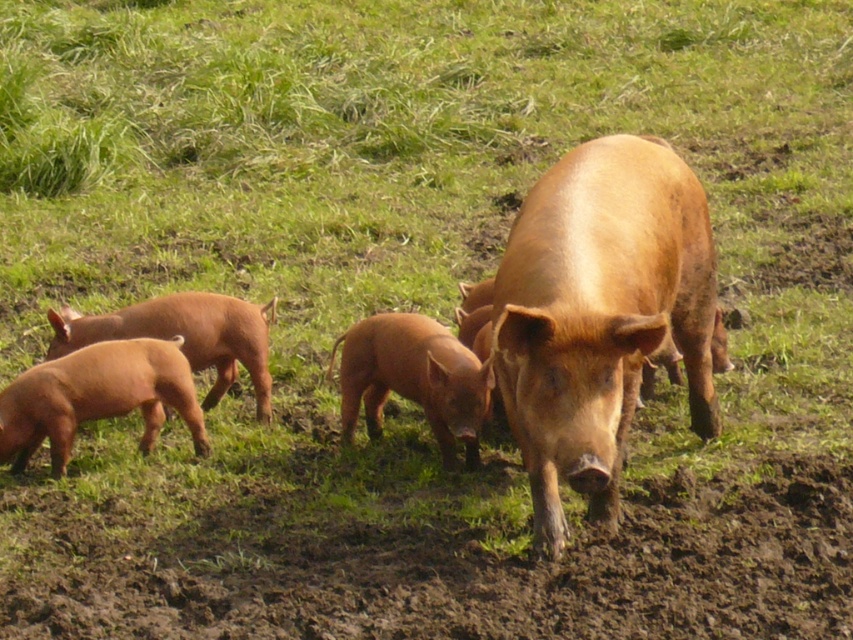
Who is lower down, brown muddy ground at center or matte brown piglet at lower left?

brown muddy ground at center is lower down.

Locate an element on the screen. Image resolution: width=853 pixels, height=640 pixels. brown muddy ground at center is located at coordinates (442, 560).

Where is `brown muddy ground at center`? brown muddy ground at center is located at coordinates (442, 560).

Which is in front, point (57, 442) or point (144, 336)?

Point (57, 442) is in front.

The image size is (853, 640). What are the coordinates of `smooth brown piglet at lower left` in the screenshot? It's located at (97, 397).

Does matte brown pig at center come behind smooth brown piglet at lower left?

No.

Does matte brown pig at center have a greater width compared to smooth brown piglet at lower left?

Correct, the width of matte brown pig at center exceeds that of smooth brown piglet at lower left.

The width and height of the screenshot is (853, 640). Identify the location of matte brown pig at center. (599, 316).